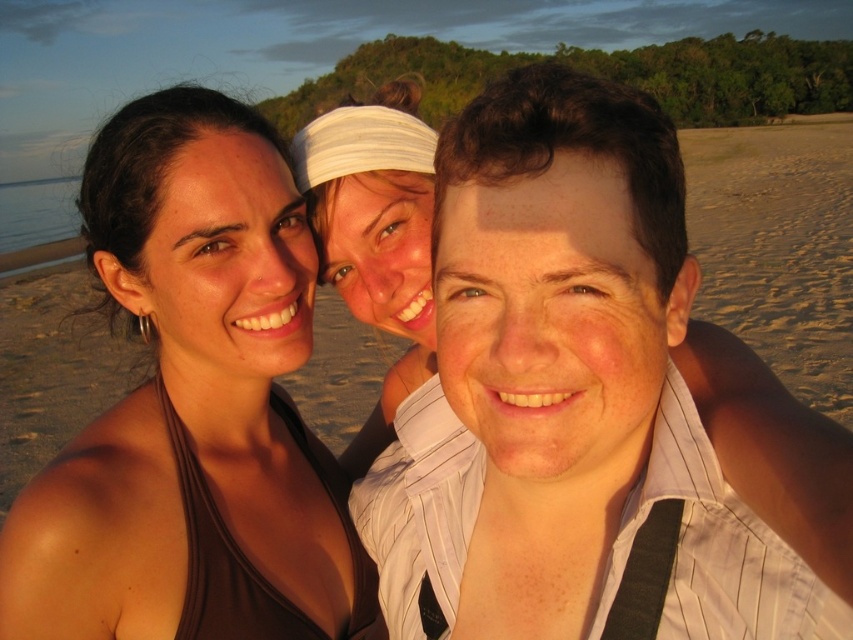
You are a photographer trying to capture a group photo of the three people. You need to ensure that the brown fabric top at left and the white fabric headband at center are at least 12 inches apart for better visibility. Based on the current positioning, will you need to adjust their positions?

The brown fabric top at left and the white fabric headband at center are currently 11.43 inches apart, which is less than the required 12 inches. Therefore, you should ask the subjects to move slightly further apart to ensure better visibility in the photo.

You are a photographer trying to adjust the lighting for a group photo. You notice the brown fabric top at left and the white fabric headband at center. Which object should you focus on to ensure proper exposure since it is closer to the camera?

The white fabric headband at center is closer to the camera than the brown fabric top at left, so focusing on it would ensure proper exposure.

In the beach selfie scene, the brown fabric top at left and the white fabric headband at center are both visible. Which one is positioned more to the left?

The brown fabric top at left is positioned more to the left than the white fabric headband at center.